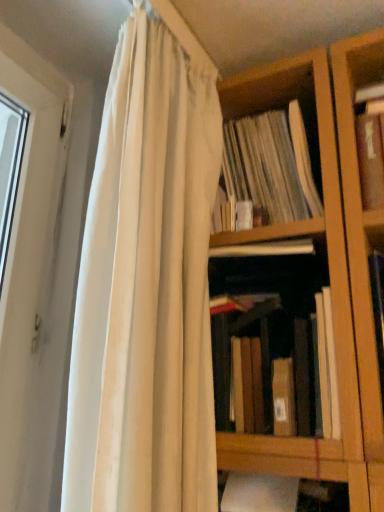
Question: From the image's perspective, does brown matte book at center appear lower than white cotton curtain at upper left?

Choices:
 (A) no
 (B) yes

Answer: (B)

Question: Is brown matte book at center thinner than white cotton curtain at upper left?

Choices:
 (A) no
 (B) yes

Answer: (A)

Question: Is brown matte book at center to the left of white cotton curtain at upper left from the viewer's perspective?

Choices:
 (A) no
 (B) yes

Answer: (A)

Question: Does brown matte book at center have a larger size compared to white cotton curtain at upper left?

Choices:
 (A) no
 (B) yes

Answer: (A)

Question: From the image's perspective, does brown matte book at center appear higher than white cotton curtain at upper left?

Choices:
 (A) no
 (B) yes

Answer: (A)

Question: From a real-world perspective, does brown matte book at center stand above white cotton curtain at upper left?

Choices:
 (A) no
 (B) yes

Answer: (A)

Question: From the image's perspective, would you say white cotton curtain at upper left is shown under brown matte book at center?

Choices:
 (A) no
 (B) yes

Answer: (A)

Question: Is white cotton curtain at upper left in contact with brown matte book at center?

Choices:
 (A) yes
 (B) no

Answer: (B)

Question: Is the depth of white cotton curtain at upper left greater than that of brown matte book at center?

Choices:
 (A) no
 (B) yes

Answer: (A)

Question: Considering the relative sizes of white cotton curtain at upper left and brown matte book at center in the image provided, is white cotton curtain at upper left smaller than brown matte book at center?

Choices:
 (A) no
 (B) yes

Answer: (A)

Question: Is white cotton curtain at upper left at the right side of brown matte book at center?

Choices:
 (A) yes
 (B) no

Answer: (B)

Question: Is white cotton curtain at upper left at the left side of brown matte book at center?

Choices:
 (A) no
 (B) yes

Answer: (B)

Question: Considering the positions of white cotton curtain at upper left and brown matte book at center in the image, is white cotton curtain at upper left bigger or smaller than brown matte book at center?

Choices:
 (A) big
 (B) small

Answer: (A)